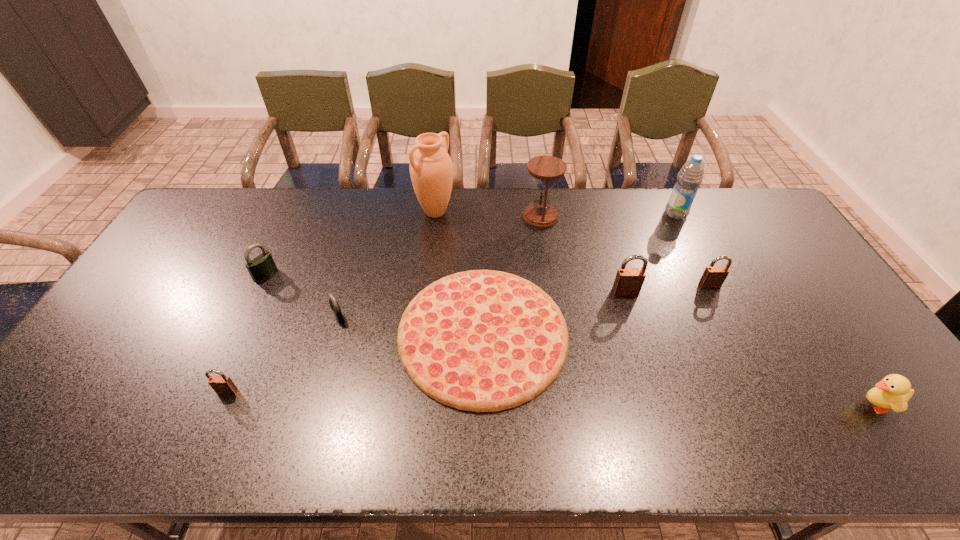
In order to click on vacant space located on the front-facing side of the seventh shortest object in this screenshot , I will do `click(652, 380)`.

The height and width of the screenshot is (540, 960). Find the location of `vacant area located 0.220m on the front-facing side of the rightmost brown padlock`. vacant area located 0.220m on the front-facing side of the rightmost brown padlock is located at coordinates (741, 349).

Identify the location of free region located on the front of the farther black padlock. The image size is (960, 540). (226, 358).

This screenshot has width=960, height=540. Identify the location of blank space located on the front-facing side of the yellow duckling. (691, 405).

The height and width of the screenshot is (540, 960). What are the coordinates of `blank space located 0.350m on the front-facing side of the yellow duckling` in the screenshot? It's located at (708, 405).

Find the location of a particular element. Image resolution: width=960 pixels, height=540 pixels. free spot located 0.150m on the front-facing side of the yellow duckling is located at coordinates (791, 405).

This screenshot has height=540, width=960. Identify the location of free spot located on the front of the nearer black padlock. (312, 411).

Image resolution: width=960 pixels, height=540 pixels. I want to click on vacant region located on the front-facing side of the smallest brown padlock, so click(204, 442).

Locate an element on the screen. The width and height of the screenshot is (960, 540). vacant space located 0.070m on the right of the shortest object is located at coordinates (592, 334).

The height and width of the screenshot is (540, 960). In order to click on urn located in the far edge section of the desktop in this screenshot , I will do `click(431, 169)`.